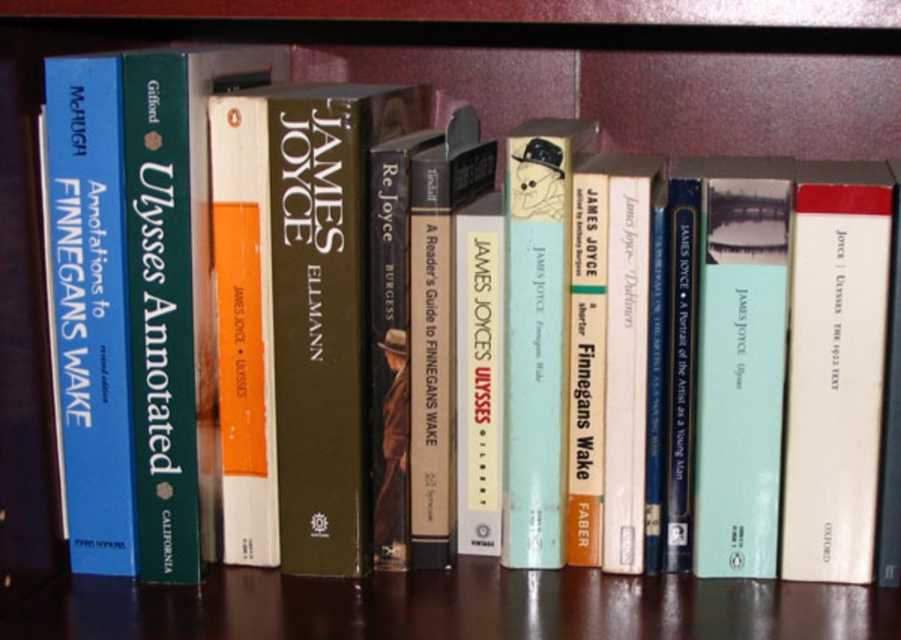
You are standing in front of the bookshelf and want to place a coffee mug that is 4 inches in diameter on the wooden table at center. Can the table accommodate the mug without it falling off?

The wooden table at center is 24.65 inches from the viewer, but the question is about the table surface size. The provided information does not specify the table dimensions, so we cannot determine if the mug will fit. More details are needed.

You are organizing a study area and need to place a wooden table at center and a white paper at center. According to the scene, where should you position the white paper relative to the wooden table?

The wooden table at center is to the left of white paper at center, so you should place the white paper to the right of the wooden table at center.

Consider the image. You are organizing a study space and have a wooden table at center and a white paper at center. Which item is smaller in size?

The wooden table at center is smaller compared to the white paper at center.